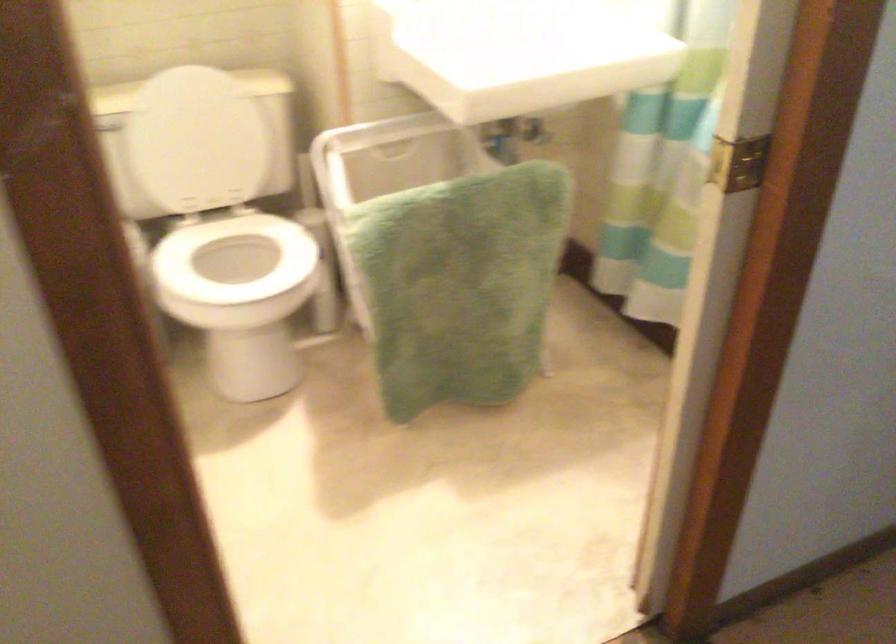
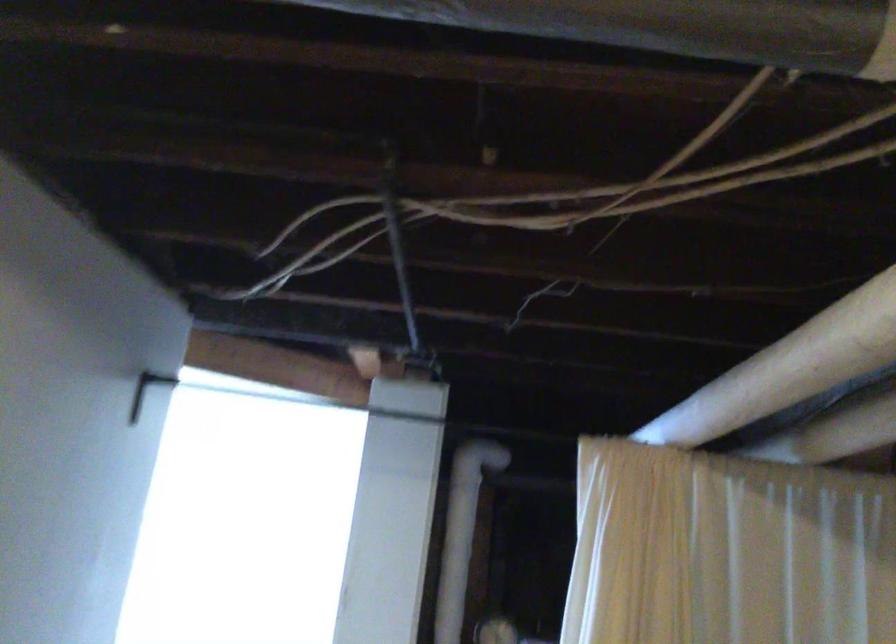
First-person continuous shooting, in which direction is the camera rotating?

The camera rotated toward right-up.